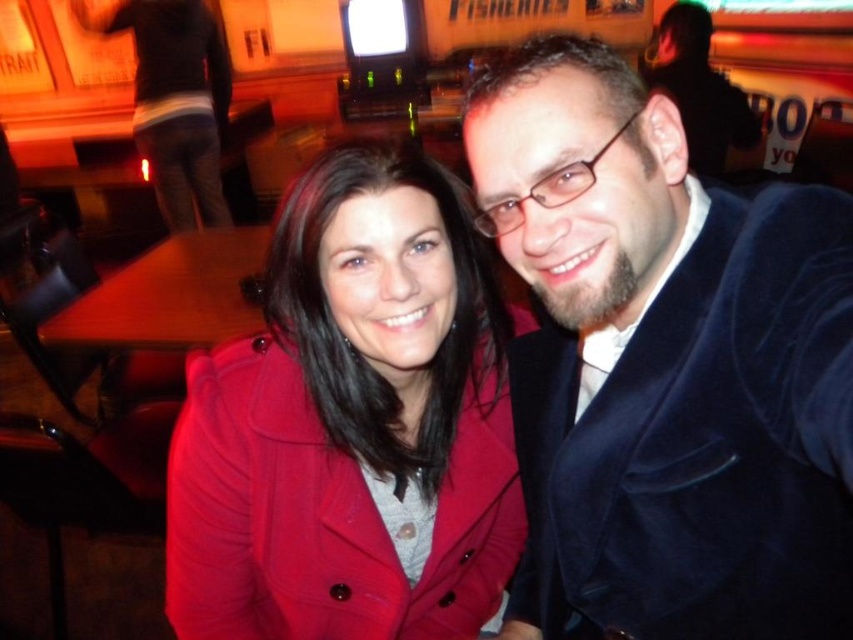
Does matte red coat at center appear on the left side of wooden table at lower left?

Incorrect, matte red coat at center is not on the left side of wooden table at lower left.

Is matte red coat at center below wooden table at lower left?

Indeed, matte red coat at center is positioned under wooden table at lower left.

Locate an element on the screen. matte red coat at center is located at coordinates (347, 442).

Where is `matte red coat at center`? The height and width of the screenshot is (640, 853). matte red coat at center is located at coordinates (347, 442).

Which is more to the left, wooden table at lower left or matte black jacket at upper right?

wooden table at lower left

Does wooden table at lower left have a greater width compared to matte black jacket at upper right?

Yes.

This screenshot has width=853, height=640. What do you see at coordinates (169, 296) in the screenshot?
I see `wooden table at lower left` at bounding box center [169, 296].

Image resolution: width=853 pixels, height=640 pixels. I want to click on wooden table at lower left, so click(169, 296).

Is matte red coat at center smaller than matte black jacket at upper right?

Correct, matte red coat at center occupies less space than matte black jacket at upper right.

Which is in front, point (511, 452) or point (701, 148)?

Point (511, 452) is more forward.

Who is more forward, [514,502] or [747,138]?

Point [514,502] is more forward.

The image size is (853, 640). I want to click on matte red coat at center, so click(x=347, y=442).